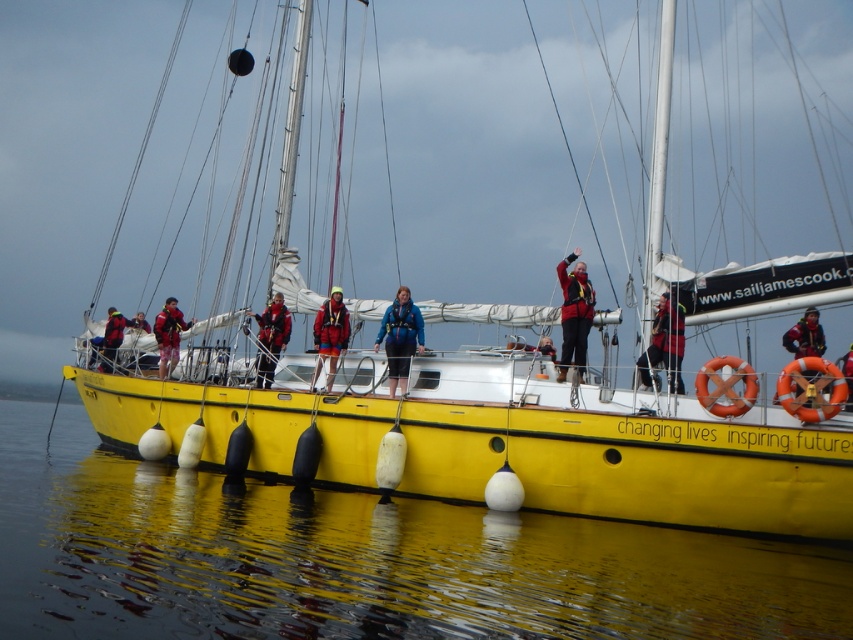
Question: Which of the following is the closest to the observer?

Choices:
 (A) matte red life jacket at center
 (B) red life vest at upper right
 (C) matte black jacket at center

Answer: (B)

Question: Is orange rubber life jacket at right to the right of red waterproof jacket at center from the viewer's perspective?

Choices:
 (A) no
 (B) yes

Answer: (B)

Question: Can you confirm if matte red jacket at center is bigger than red life jacket at center?

Choices:
 (A) no
 (B) yes

Answer: (B)

Question: Which point is farther to the camera?

Choices:
 (A) blue fabric jacket at center
 (B) matte black life vest at upper right
 (C) red jacket at upper right

Answer: (A)

Question: Does glossy water at lower center lie in front of red life vest at upper right?

Choices:
 (A) no
 (B) yes

Answer: (B)

Question: Which point is farther from the camera taking this photo?

Choices:
 (A) (285, 531)
 (B) (279, 324)
 (C) (167, 360)
 (D) (555, 348)

Answer: (C)